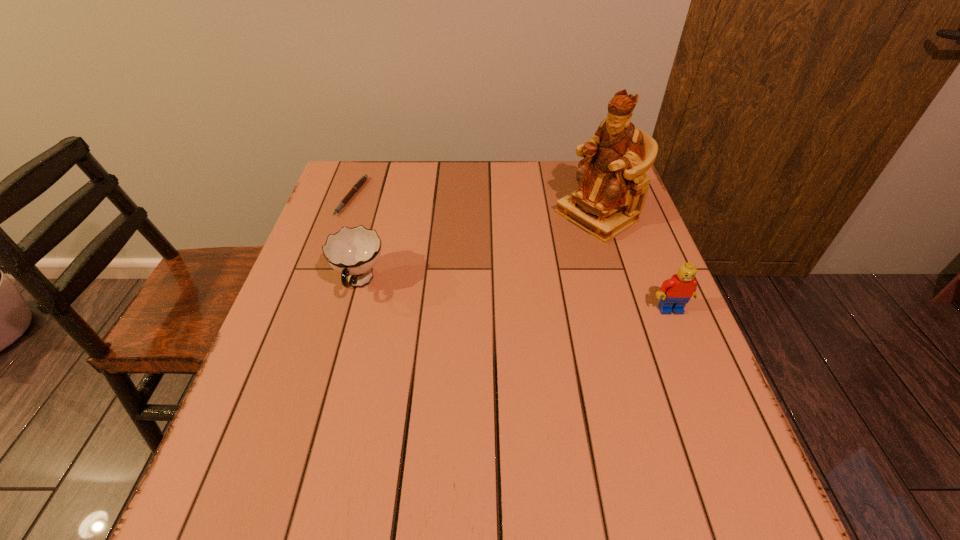
The width and height of the screenshot is (960, 540). What are the coordinates of `blank space at the far edge of the desktop` in the screenshot? It's located at (485, 192).

Identify the location of free space at the near edge of the desktop. click(387, 458).

Find the location of `vacant space at the left edge of the desktop`. vacant space at the left edge of the desktop is located at coordinates (357, 215).

Locate an element on the screen. free region at the right edge is located at coordinates (613, 274).

I want to click on vacant space at the far left corner, so [x=349, y=162].

In the image, there is a desktop. At what (x,y) coordinates should I click in order to perform the action: click on vacant space at the near left corner. Please return your answer as a coordinate pair (x, y). The image size is (960, 540). Looking at the image, I should click on (322, 416).

Find the location of a particular element. This screenshot has height=540, width=960. unoccupied position between the figurine and the Lego is located at coordinates (634, 263).

Identify the location of vacant space that is in between the tallest object and the Lego. (634, 263).

This screenshot has width=960, height=540. Identify the location of vacant area that lies between the figurine and the cup. (478, 249).

Where is `vacant area between the figurine and the third shortest object`? vacant area between the figurine and the third shortest object is located at coordinates (634, 263).